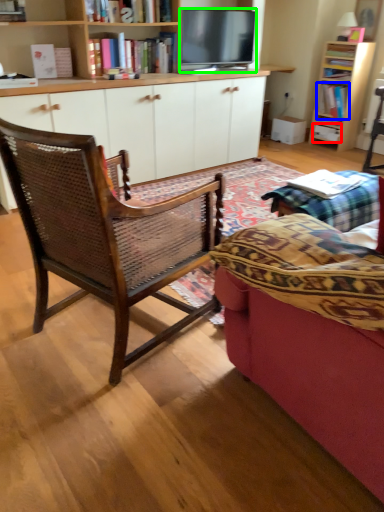
Question: Based on their relative distances, which object is farther from drawer (highlighted by a red box)? Choose from book (highlighted by a blue box) and television (highlighted by a green box).

Choices:
 (A) book
 (B) television

Answer: (B)